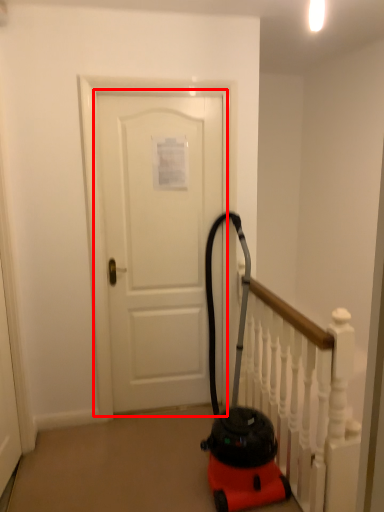
Question: Observing the image, what is the correct spatial positioning of door (annotated by the red box) in reference to rail?

Choices:
 (A) right
 (B) left

Answer: (B)